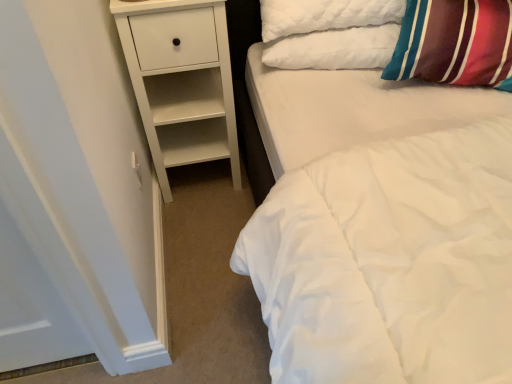
At what (x,y) coordinates should I click in order to perform the action: click on white matte/finish nightstand at left. Please return your answer as a coordinate pair (x, y). Looking at the image, I should click on (181, 81).

The width and height of the screenshot is (512, 384). What do you see at coordinates (181, 81) in the screenshot?
I see `white matte/finish nightstand at left` at bounding box center [181, 81].

Identify the location of white matte/finish nightstand at left. Image resolution: width=512 pixels, height=384 pixels. (181, 81).